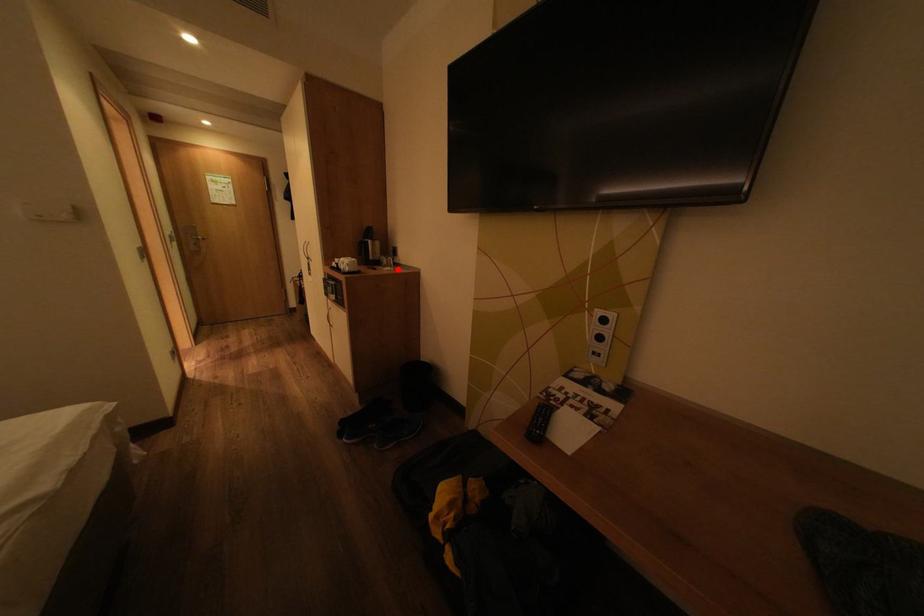
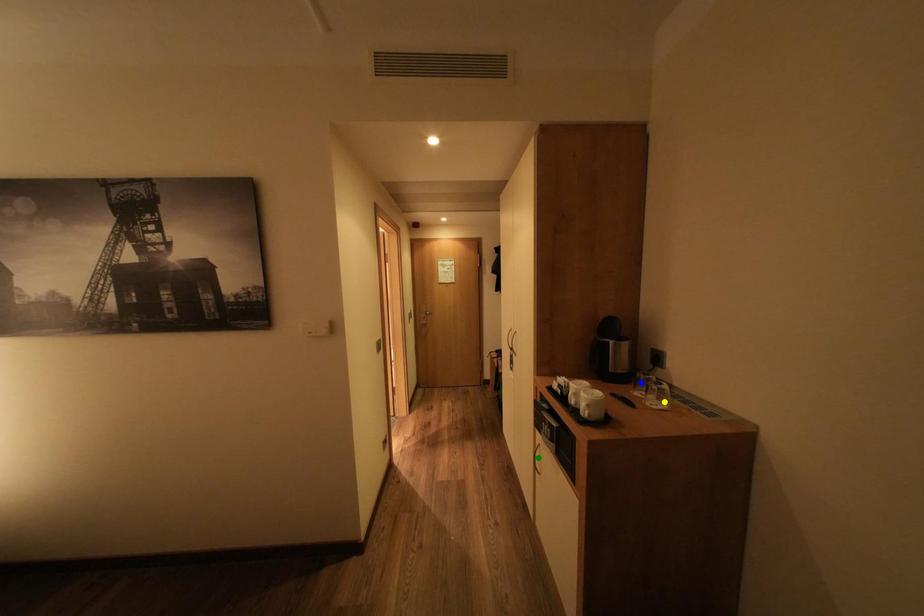
Question: I am providing you with two images of the same scene from different viewpoints. A red point is marked on the first image. You are given multiple points on the second image. Which spot in image 2 lines up with the point in image 1?

Choices:
 (A) blue point
 (B) yellow point
 (C) green point

Answer: (B)